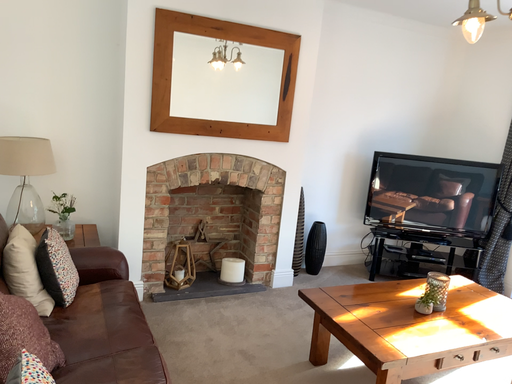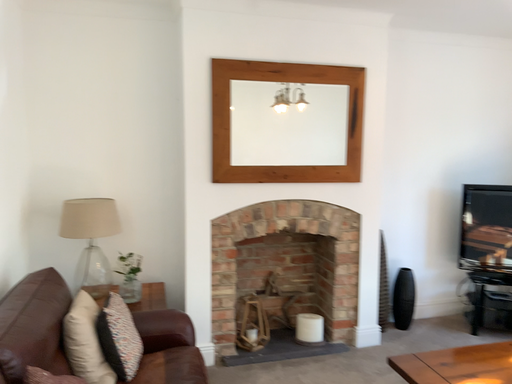
Question: How did the camera likely rotate when shooting the video?

Choices:
 (A) rotated left
 (B) rotated right

Answer: (A)